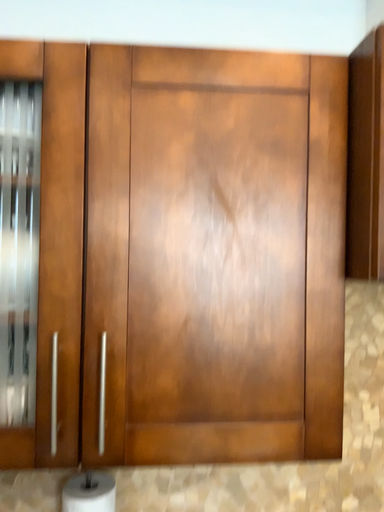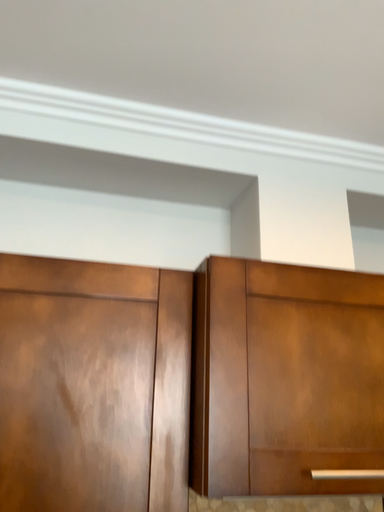
Question: How did the camera likely rotate when shooting the video?

Choices:
 (A) rotated downward
 (B) rotated upward

Answer: (B)